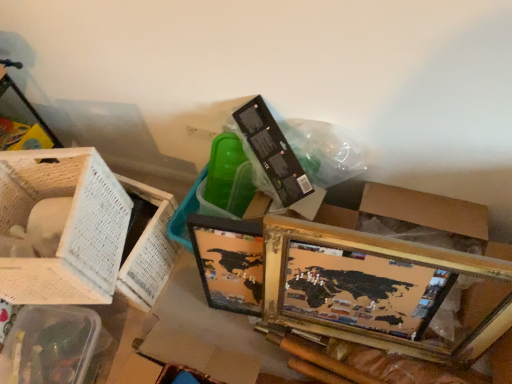
Question: Considering the relative positions of clear plastic basket at lower left, which appears as the 2th basket when viewed from the top, and gold-framed map at lower right in the image provided, is clear plastic basket at lower left, which appears as the 2th basket when viewed from the top, to the right of gold-framed map at lower right from the viewer's perspective?

Choices:
 (A) yes
 (B) no

Answer: (B)

Question: Are clear plastic basket at lower left, which appears as the 2th basket when viewed from the top, and gold-framed map at lower right located far from each other?

Choices:
 (A) no
 (B) yes

Answer: (A)

Question: Does clear plastic basket at lower left, which appears as the 2th basket when viewed from the top, have a larger size compared to gold-framed map at lower right?

Choices:
 (A) no
 (B) yes

Answer: (A)

Question: Considering the relative sizes of clear plastic basket at lower left, which appears as the 2th basket when viewed from the top, and gold-framed map at lower right in the image provided, is clear plastic basket at lower left, which appears as the 2th basket when viewed from the top, wider than gold-framed map at lower right?

Choices:
 (A) no
 (B) yes

Answer: (B)

Question: Could you tell me if clear plastic basket at lower left, which appears as the 2th basket when viewed from the top, is turned towards gold-framed map at lower right?

Choices:
 (A) no
 (B) yes

Answer: (A)

Question: Considering the relative positions of clear plastic basket at lower left, which appears as the 2th basket when viewed from the top, and gold-framed map at lower right in the image provided, is clear plastic basket at lower left, which appears as the 2th basket when viewed from the top, to the left of gold-framed map at lower right from the viewer's perspective?

Choices:
 (A) no
 (B) yes

Answer: (B)

Question: Is gold-framed map at lower right to the left of clear plastic basket at lower left, which appears as the 2th basket when viewed from the top, from the viewer's perspective?

Choices:
 (A) no
 (B) yes

Answer: (A)

Question: From the image's perspective, is gold-framed map at lower right under clear plastic basket at lower left, which appears as the 2th basket when viewed from the top?

Choices:
 (A) yes
 (B) no

Answer: (B)

Question: Can you confirm if gold-framed map at lower right is shorter than clear plastic basket at lower left, which is counted as the 1th basket, starting from the bottom?

Choices:
 (A) yes
 (B) no

Answer: (B)

Question: Does gold-framed map at lower right have a lesser width compared to clear plastic basket at lower left, which is counted as the 1th basket, starting from the bottom?

Choices:
 (A) yes
 (B) no

Answer: (A)

Question: From a real-world perspective, is gold-framed map at lower right physically below clear plastic basket at lower left, which appears as the 2th basket when viewed from the top?

Choices:
 (A) no
 (B) yes

Answer: (A)

Question: Does gold-framed map at lower right come behind clear plastic basket at lower left, which appears as the 2th basket when viewed from the top?

Choices:
 (A) no
 (B) yes

Answer: (A)